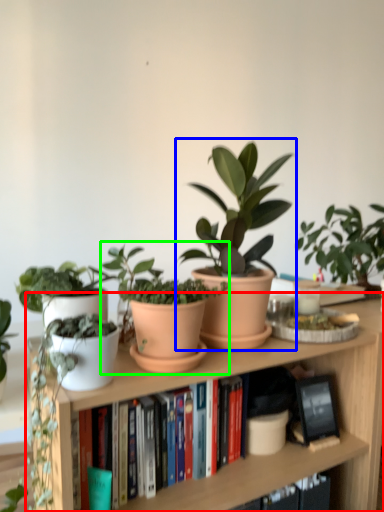
Question: Estimate the real-world distances between objects in this image. Which object is farther from bookcase (highlighted by a red box), houseplant (highlighted by a blue box) or houseplant (highlighted by a green box)?

Choices:
 (A) houseplant
 (B) houseplant

Answer: (A)